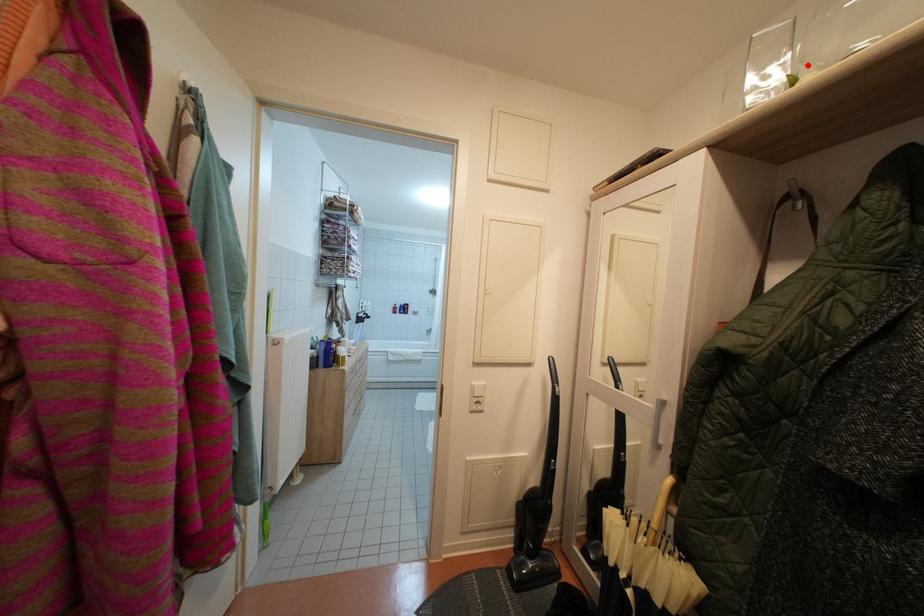
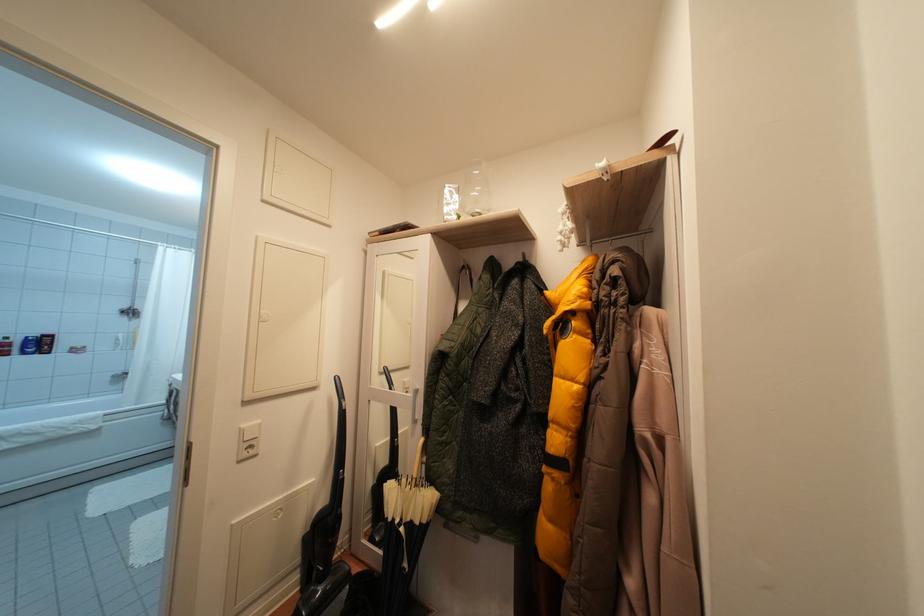
In the second image, find the point that corresponds to the highlighted location in the first image.

(468, 212)